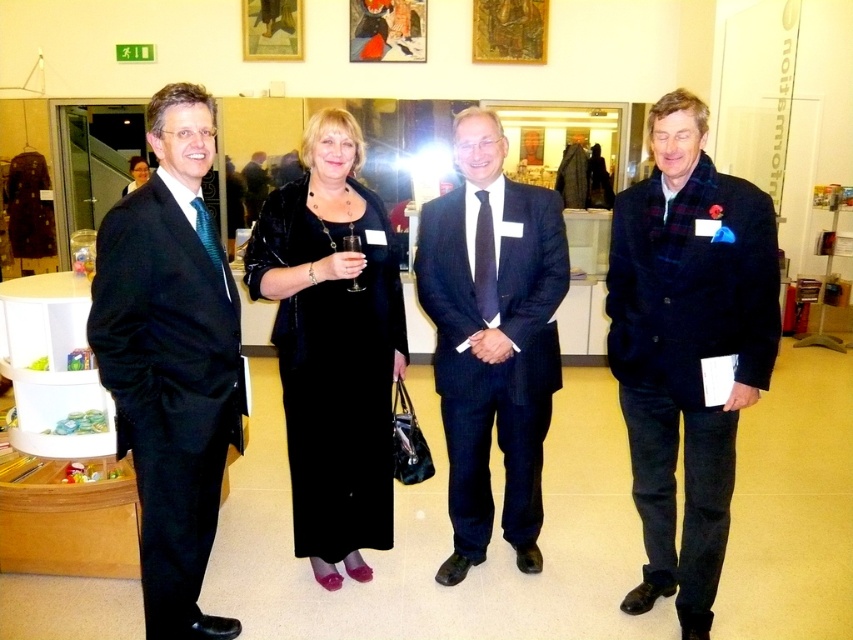
You are standing in the room and want to find the dark blue suit at center. Where is the point at coordinates (492, 337) located?

The point at coordinates (492, 337) is located on the dark blue suit at center.

You are standing in the room and want to move towards the two points marked in the image. Which point, point (447, 310) or point (271, 33), will you reach first?

Point (447, 310) is closer to the viewer than point (271, 33), so you will reach point (447, 310) first.